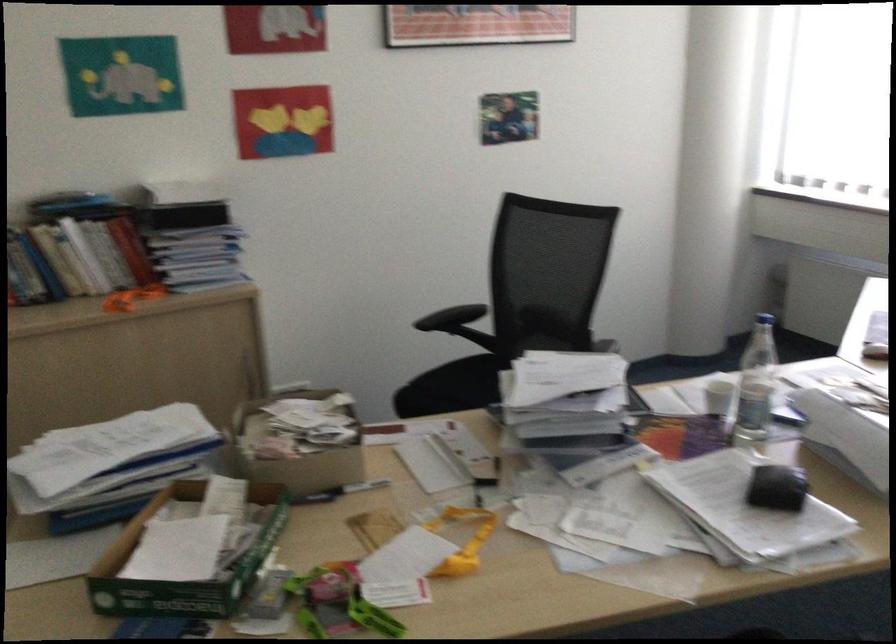
The width and height of the screenshot is (896, 644). What do you see at coordinates (298, 442) in the screenshot?
I see `the small cardboard box` at bounding box center [298, 442].